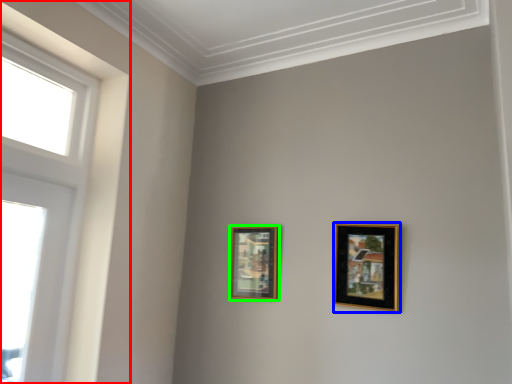
Question: Which object is the closest to the window (highlighted by a red box)? Choose among these: picture frame (highlighted by a blue box) or picture frame (highlighted by a green box).

Choices:
 (A) picture frame
 (B) picture frame

Answer: (B)